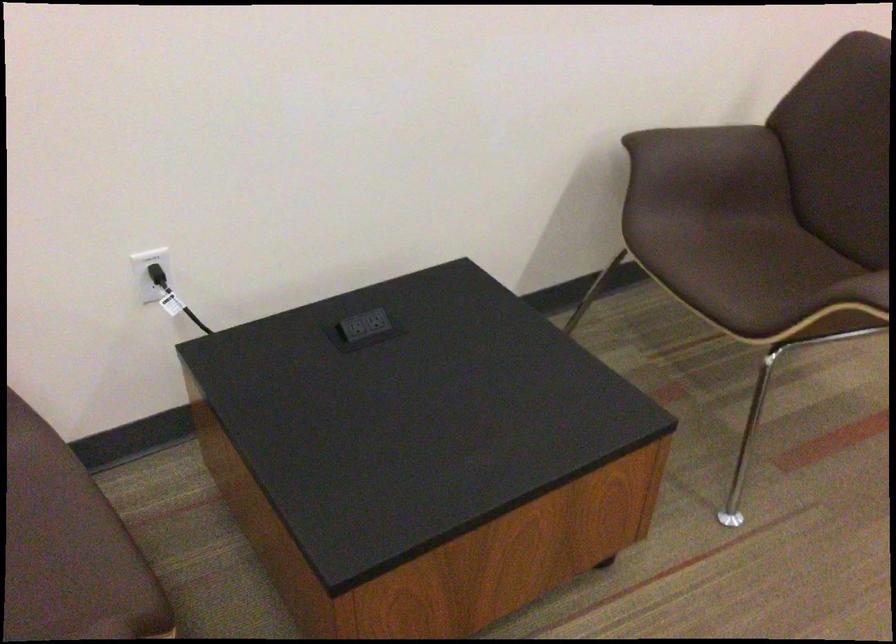
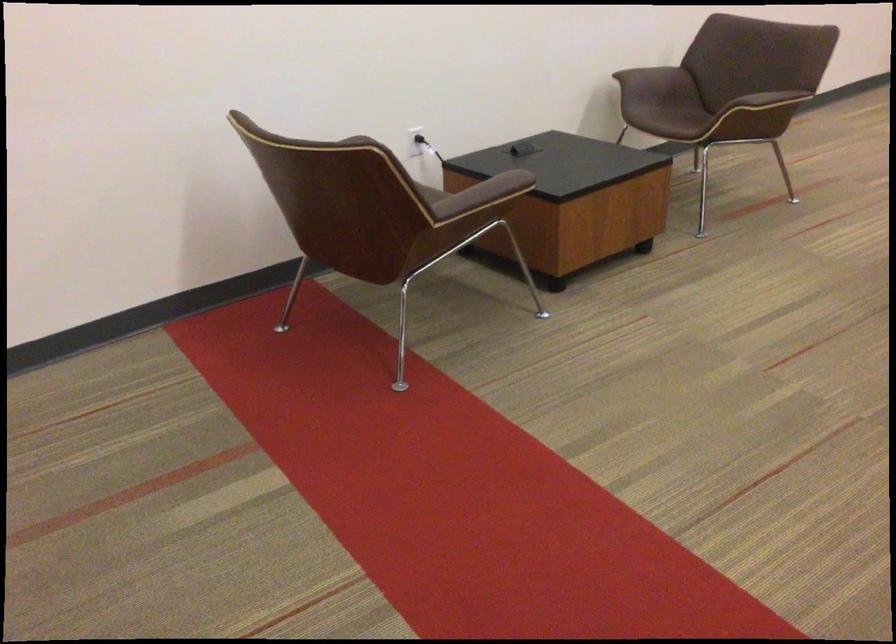
Where in the second image is the point corresponding to [147,292] from the first image?

(415, 140)